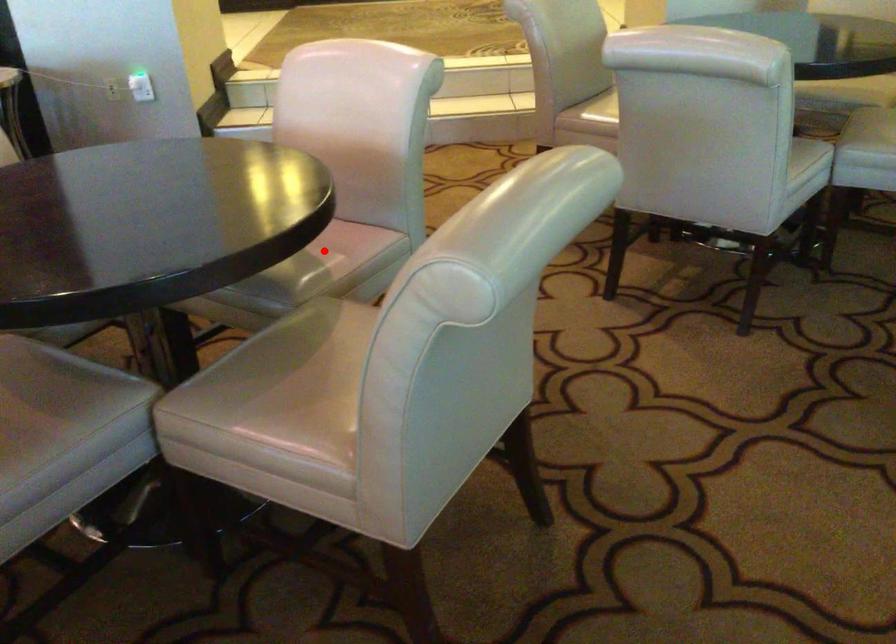
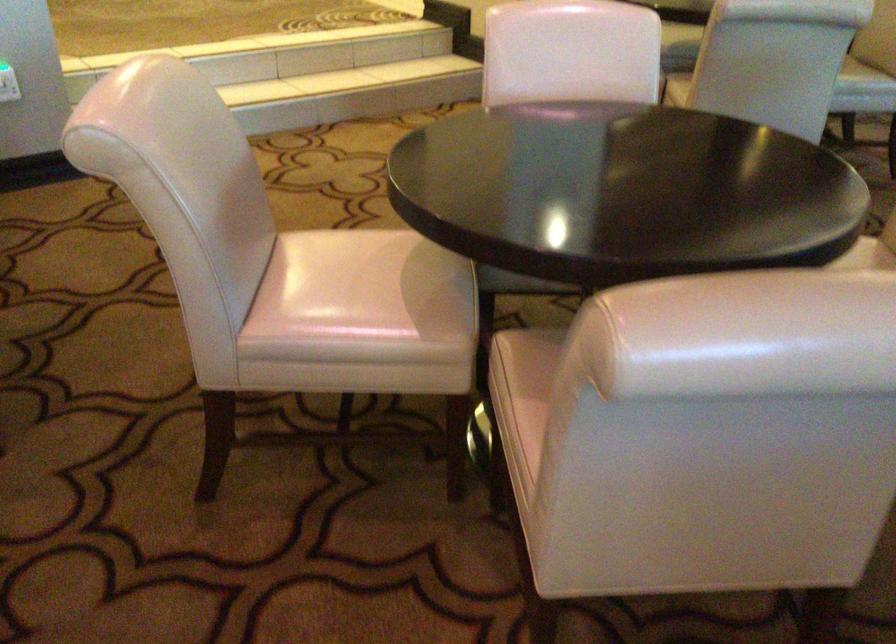
Question: I am providing you with two images of the same scene from different viewpoints. A red point is marked on the first image. Can you still see the location of the red point in image 2?

Choices:
 (A) Yes
 (B) No

Answer: (B)